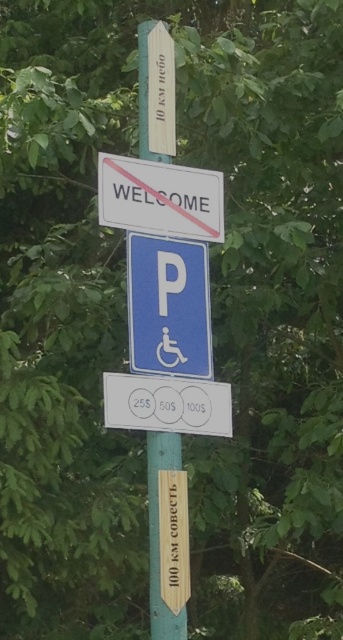
From the picture: You are a park visitor who wants to check the distance to the nearest parking lot. You see the white plastic sign at upper center and the green wooden pole at center. Which object should you look at for the distance information?

The white plastic sign at upper center is below the green wooden pole at center. Since the white plastic sign at upper center is positioned lower than the green wooden pole at center, it might contain additional information like distances. However, according to the scene description, the top sign says 10 km sky, which might indicate distance to a point of interest. Therefore, the white plastic sign at upper center could provide the distance information you need.

In the scene shown: You are a delivery driver who needs to park your vehicle near the blue plastic parking sign at center. The parking space is marked by the green wooden pole at center. Can your vehicle fit between them if it requires 15 inches of space?

The blue plastic parking sign at center and green wooden pole at center are 14.60 inches apart, which is less than the required 15 inches. Therefore, the vehicle cannot fit between them.